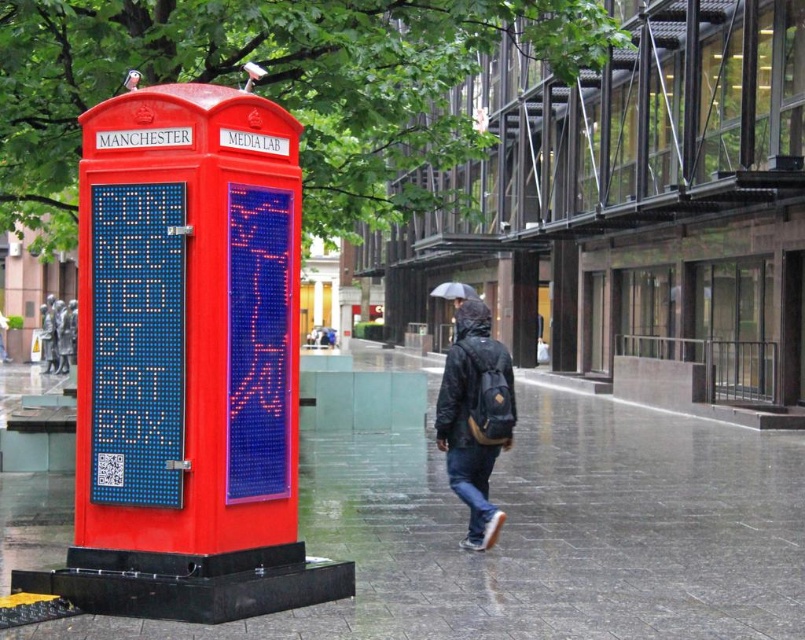
Which is above, glossy concrete pavement at lower center or dark blue backpack at center?

glossy concrete pavement at lower center is above.

Does glossy concrete pavement at lower center appear over dark blue backpack at center?

Yes.

Is point (597, 620) in front of point (469, 545)?

Yes, point (597, 620) is closer to viewer.

This screenshot has width=805, height=640. I want to click on glossy concrete pavement at lower center, so click(541, 531).

Is the position of glossy concrete pavement at lower center more distant than that of black matte umbrella at upper center?

No.

Who is higher up, glossy concrete pavement at lower center or black matte umbrella at upper center?

Positioned higher is black matte umbrella at upper center.

Find the location of a particular element. Image resolution: width=805 pixels, height=640 pixels. glossy concrete pavement at lower center is located at coordinates (541, 531).

Who is positioned more to the right, dark blue backpack at center or black matte umbrella at upper center?

black matte umbrella at upper center

Which is in front, point (486, 513) or point (444, 289)?

Point (486, 513) is more forward.

Where is `dark blue backpack at center`? This screenshot has height=640, width=805. dark blue backpack at center is located at coordinates (473, 417).